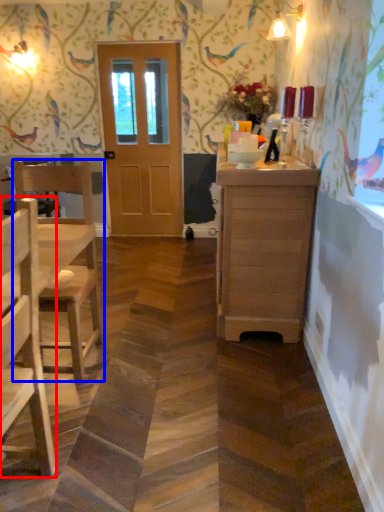
Question: Which object is further to the camera taking this photo, chair (highlighted by a red box) or chair (highlighted by a blue box)?

Choices:
 (A) chair
 (B) chair

Answer: (B)